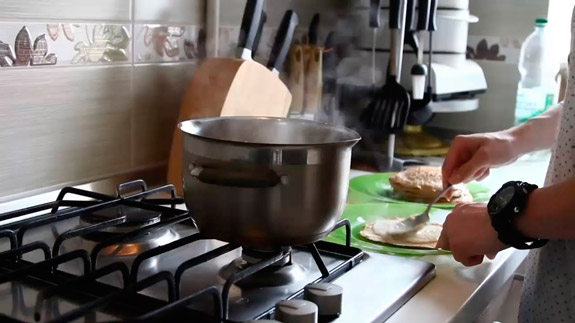
Find the location of a particular element. The image size is (575, 323). pot is located at coordinates click(304, 158).